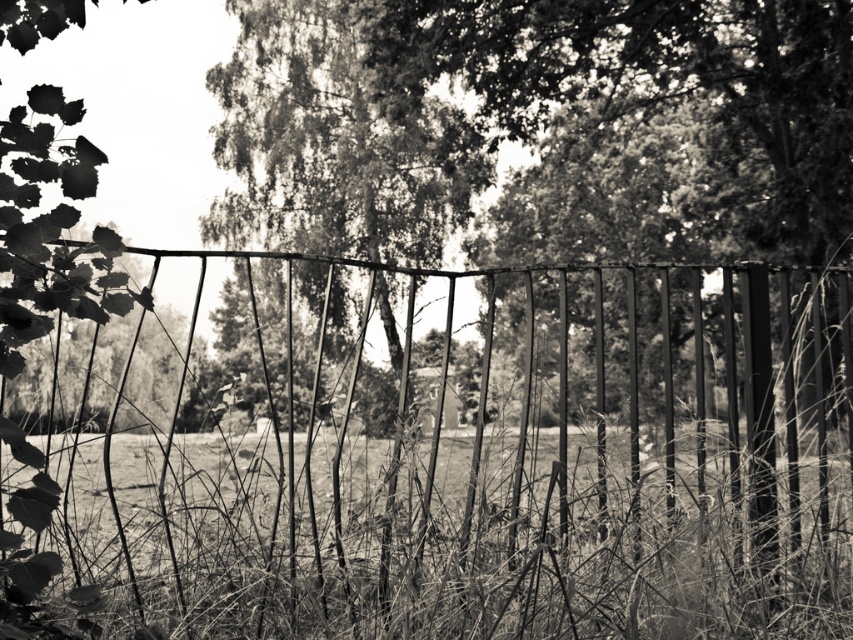
You are a landscape architect designing a walking path that needs to be 10 meters long. You want to place the path between the grainy textured grass at center and the thick textured foliage at center. Can the path fit between them?

The distance between the grainy textured grass at center and the thick textured foliage at center is 9.90 meters, so the path cannot fit as it requires 10 meters.

In the scene shown: Based on the scene described, which object is closer to the viewer between the grainy textured grass at center and the thick textured foliage at center?

The grainy textured grass at center is closer to the viewer because it is shorter than the thick textured foliage at center, making it appear in the foreground.